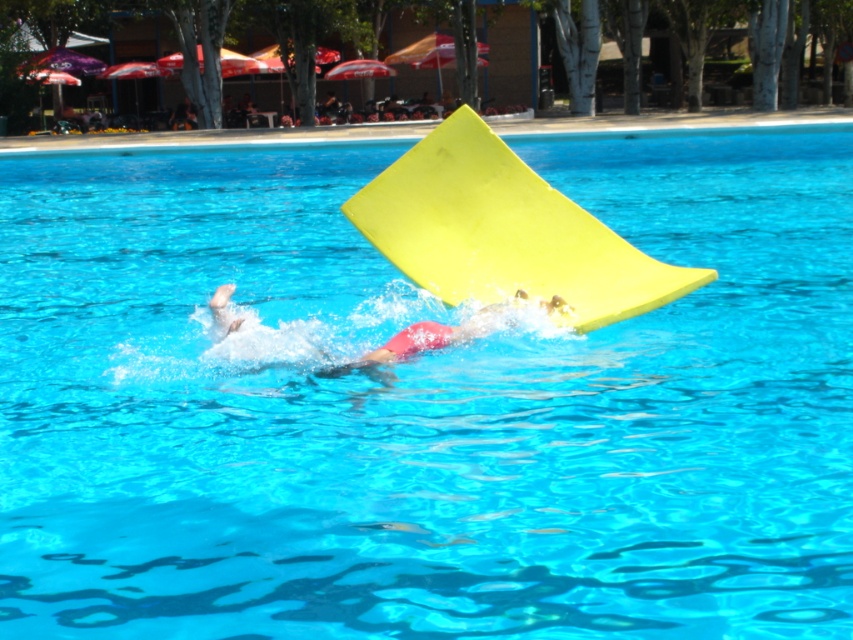
Does yellow foam slide at center have a lesser width compared to red matte swimmer at center?

In fact, yellow foam slide at center might be wider than red matte swimmer at center.

Is yellow foam slide at center to the left of red matte swimmer at center from the viewer's perspective?

Incorrect, yellow foam slide at center is not on the left side of red matte swimmer at center.

At what (x,y) coordinates should I click in order to perform the action: click on yellow foam slide at center. Please return your answer as a coordinate pair (x, y). This screenshot has width=853, height=640. Looking at the image, I should click on (503, 230).